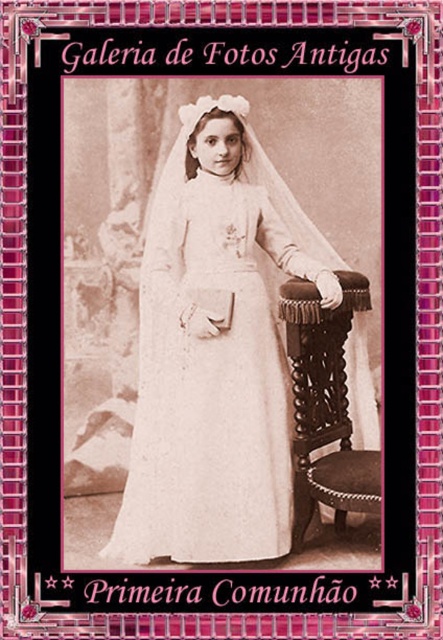
Question: Can you confirm if white lace dress at center is wider than brown wood stool at right?

Choices:
 (A) no
 (B) yes

Answer: (B)

Question: Which of the following is the closest to the observer?

Choices:
 (A) white lace dress at center
 (B) brown wood stool at right

Answer: (B)

Question: Which of the following is the closest to the observer?

Choices:
 (A) brown wood stool at right
 (B) white lace dress at center

Answer: (A)

Question: Does white lace dress at center appear on the left side of brown wood stool at right?

Choices:
 (A) no
 (B) yes

Answer: (B)

Question: Does white lace dress at center have a greater width compared to brown wood stool at right?

Choices:
 (A) yes
 (B) no

Answer: (A)